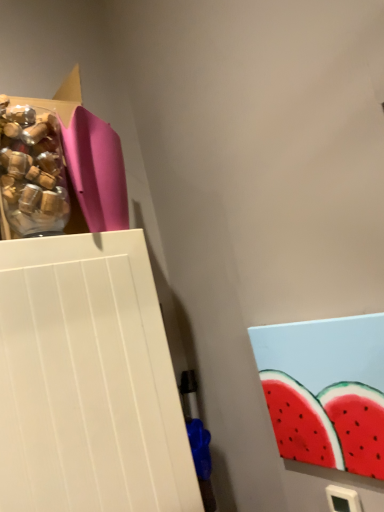
Question: In the image, is translucent plastic bottle at upper left positioned in front of or behind pink matte paper at upper left?

Choices:
 (A) behind
 (B) front

Answer: (B)

Question: In the image, is translucent plastic bottle at upper left on the left side or the right side of pink matte paper at upper left?

Choices:
 (A) left
 (B) right

Answer: (A)

Question: Based on their sizes in the image, would you say translucent plastic bottle at upper left is bigger or smaller than pink matte paper at upper left?

Choices:
 (A) big
 (B) small

Answer: (B)

Question: Is pink matte paper at upper left to the left or to the right of translucent plastic bottle at upper left in the image?

Choices:
 (A) right
 (B) left

Answer: (A)

Question: Is pink matte paper at upper left in front of or behind translucent plastic bottle at upper left in the image?

Choices:
 (A) behind
 (B) front

Answer: (A)

Question: Do you think pink matte paper at upper left is within translucent plastic bottle at upper left, or outside of it?

Choices:
 (A) inside
 (B) outside

Answer: (B)

Question: Is pink matte paper at upper left wider or thinner than translucent plastic bottle at upper left?

Choices:
 (A) wide
 (B) thin

Answer: (A)